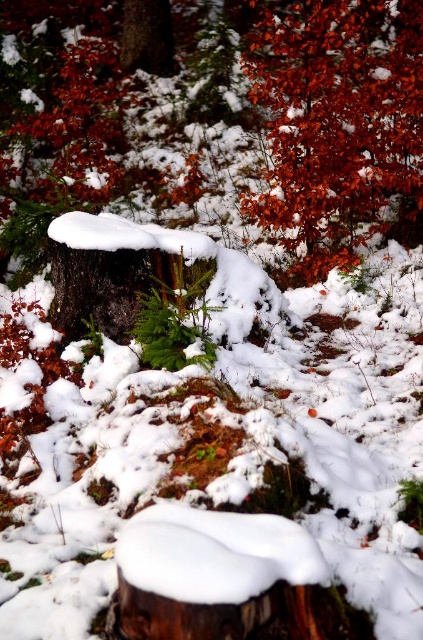
Question: Is shiny red leaves at upper right to the left of green matte fern at center from the viewer's perspective?

Choices:
 (A) no
 (B) yes

Answer: (A)

Question: In this image, where is shiny red leaves at upper right located relative to green matte fern at center?

Choices:
 (A) below
 (B) above

Answer: (B)

Question: Which of the following is the farthest from the observer?

Choices:
 (A) green matte fern at center
 (B) shiny red leaves at upper right

Answer: (B)

Question: Is shiny red leaves at upper right behind green matte fern at center?

Choices:
 (A) no
 (B) yes

Answer: (B)